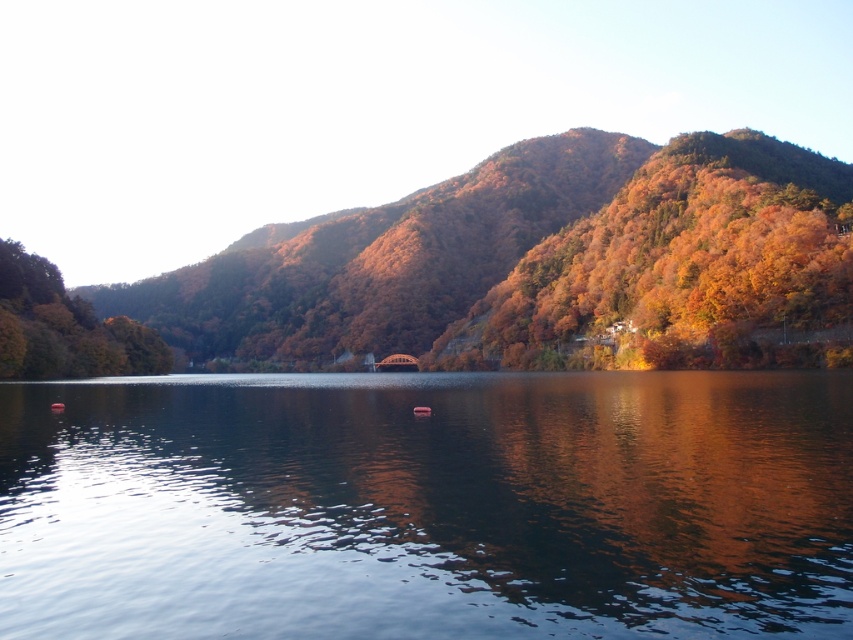
Question: Is transparent water at center behind green matte tree at left?

Choices:
 (A) yes
 (B) no

Answer: (B)

Question: Does transparent water at center have a smaller size compared to autumn leaves at upper right?

Choices:
 (A) yes
 (B) no

Answer: (A)

Question: Is autumn leaves at upper right closer to camera compared to green matte tree at left?

Choices:
 (A) yes
 (B) no

Answer: (A)

Question: Which of these objects is positioned farthest from the autumn leaves at upper right?

Choices:
 (A) transparent water at center
 (B) green matte tree at left

Answer: (B)

Question: Which is farther from the autumn leaves at upper right?

Choices:
 (A) green matte tree at left
 (B) transparent water at center

Answer: (A)

Question: Based on their relative distances, which object is farther from the transparent water at center?

Choices:
 (A) autumn leaves at upper right
 (B) green matte tree at left

Answer: (A)